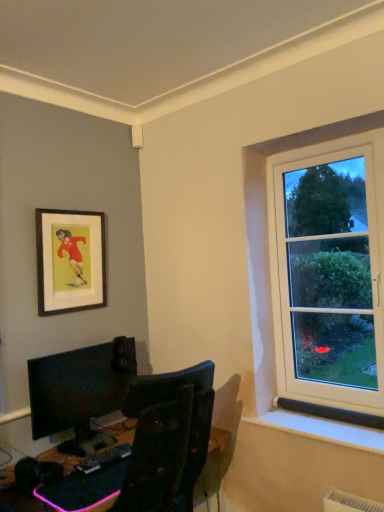
Question: Is black plastic desk at lower left wider than wooden framed poster at upper left?

Choices:
 (A) yes
 (B) no

Answer: (A)

Question: Is black plastic desk at lower left further to camera compared to wooden framed poster at upper left?

Choices:
 (A) yes
 (B) no

Answer: (B)

Question: From the image's perspective, is black plastic desk at lower left located beneath wooden framed poster at upper left?

Choices:
 (A) yes
 (B) no

Answer: (A)

Question: From the image's perspective, does black plastic desk at lower left appear higher than wooden framed poster at upper left?

Choices:
 (A) yes
 (B) no

Answer: (B)

Question: Can you confirm if black plastic desk at lower left is thinner than wooden framed poster at upper left?

Choices:
 (A) no
 (B) yes

Answer: (A)

Question: From a real-world perspective, is black plastic desk at lower left on wooden framed poster at upper left?

Choices:
 (A) yes
 (B) no

Answer: (B)

Question: Is black plastic keyboard at lower center surrounding wooden framed poster at upper left?

Choices:
 (A) no
 (B) yes

Answer: (A)

Question: From a real-world perspective, is black plastic keyboard at lower center located beneath wooden framed poster at upper left?

Choices:
 (A) no
 (B) yes

Answer: (B)

Question: From the image's perspective, is black plastic keyboard at lower center beneath wooden framed poster at upper left?

Choices:
 (A) no
 (B) yes

Answer: (B)

Question: Are black plastic keyboard at lower center and wooden framed poster at upper left making contact?

Choices:
 (A) yes
 (B) no

Answer: (B)

Question: Is black plastic keyboard at lower center shorter than wooden framed poster at upper left?

Choices:
 (A) no
 (B) yes

Answer: (B)

Question: From the image's perspective, is black plastic keyboard at lower center on top of wooden framed poster at upper left?

Choices:
 (A) no
 (B) yes

Answer: (A)

Question: Can we say black plastic desk at lower left lies outside matte black monitor at lower left?

Choices:
 (A) yes
 (B) no

Answer: (A)